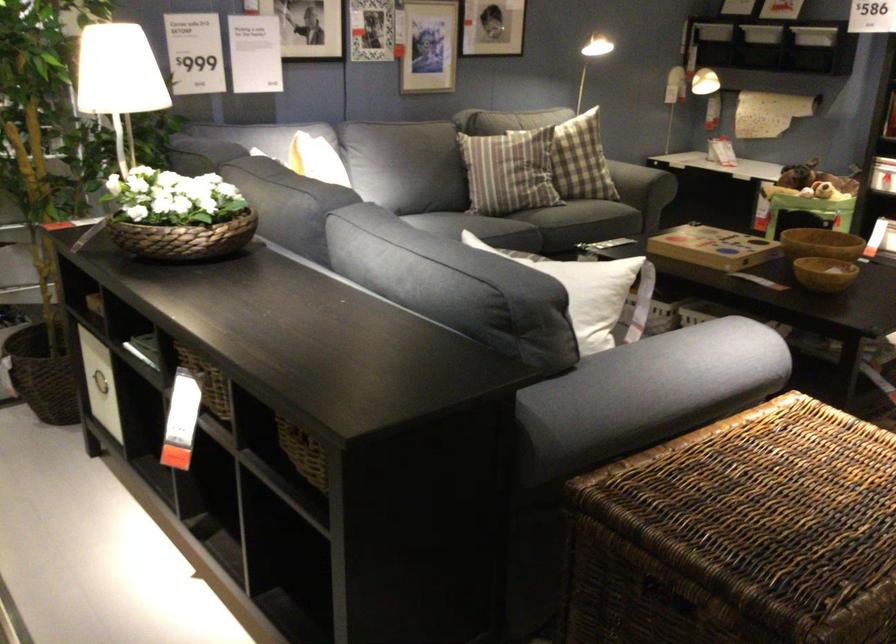
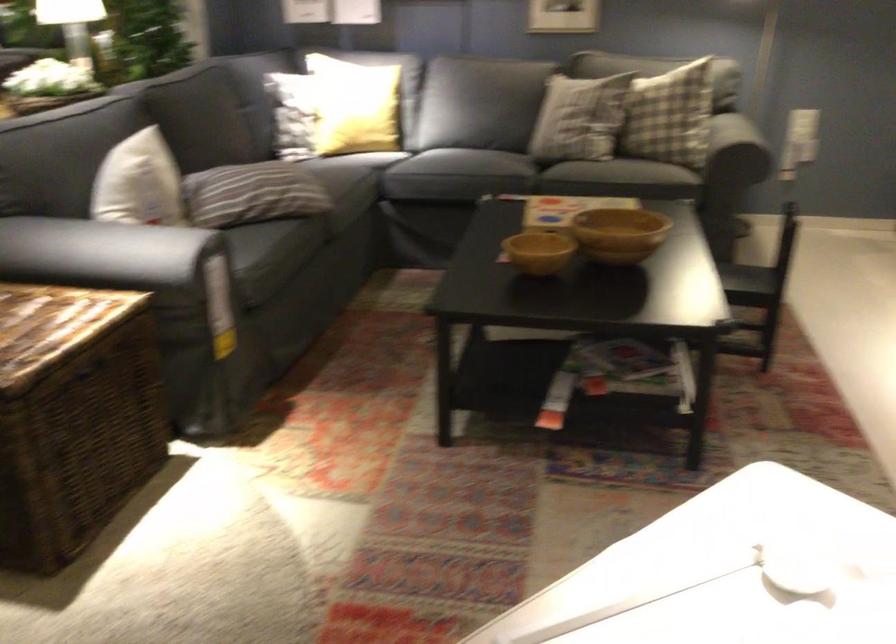
Find the pixel in the second image that matches [589,281] in the first image.

(139, 183)